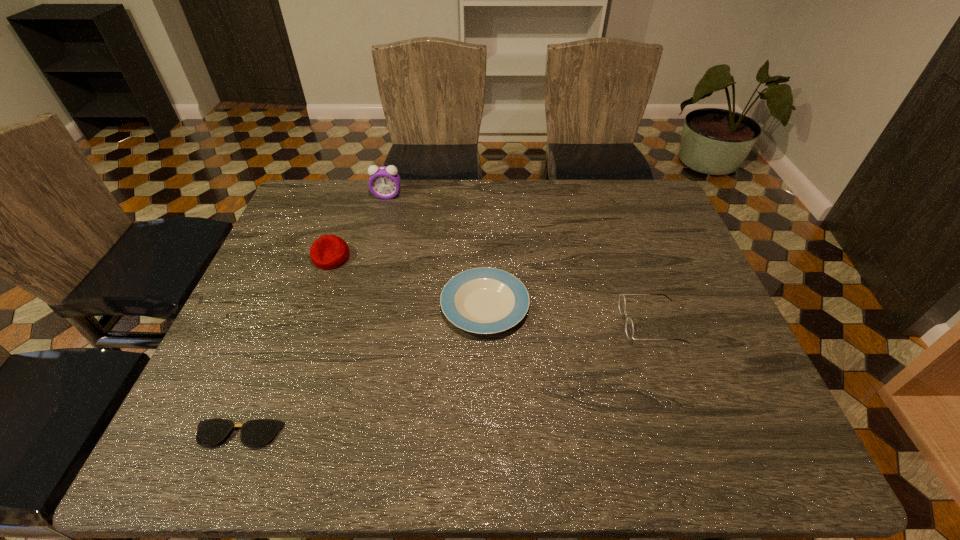
Find the location of a particular element. spectacles positioned at the left edge is located at coordinates (254, 433).

Locate an element on the screen. object present at the right edge is located at coordinates (629, 327).

Find the location of a particular element. object located in the near left corner section of the desktop is located at coordinates (254, 433).

In the image, there is a desktop. Find the location of `vacant space at the far edge`. vacant space at the far edge is located at coordinates (443, 221).

The image size is (960, 540). In order to click on free space at the near edge of the desktop in this screenshot , I will do `click(284, 457)`.

The height and width of the screenshot is (540, 960). What are the coordinates of `vacant region at the left edge of the desktop` in the screenshot? It's located at (288, 240).

This screenshot has width=960, height=540. In the image, there is a desktop. Find the location of `free region at the right edge`. free region at the right edge is located at coordinates (729, 393).

This screenshot has width=960, height=540. Identify the location of free spot at the far left corner of the desktop. [315, 182].

In the image, there is a desktop. At what (x,y) coordinates should I click in order to perform the action: click on vacant region at the far right corner. Please return your answer as a coordinate pair (x, y). Looking at the image, I should click on (613, 185).

In order to click on vacant space that's between the alarm clock and the nearer spectacles in this screenshot , I will do `click(312, 315)`.